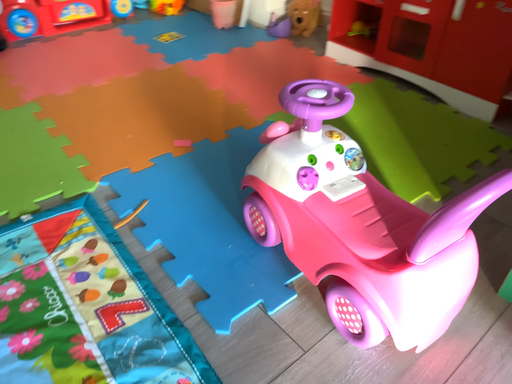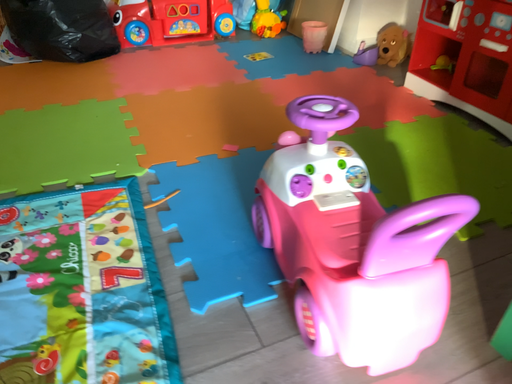
Question: Which way did the camera rotate in the video?

Choices:
 (A) rotated right
 (B) rotated left

Answer: (B)